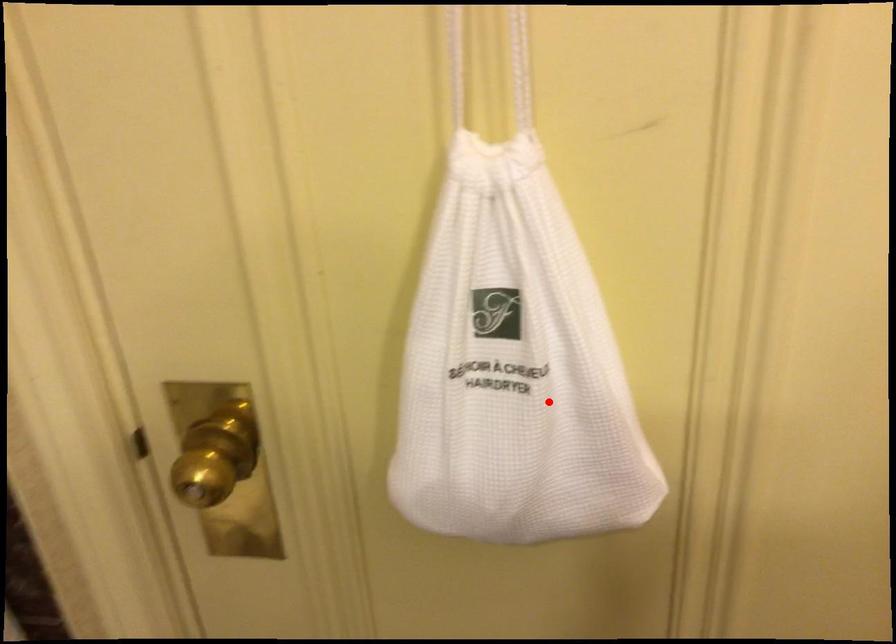
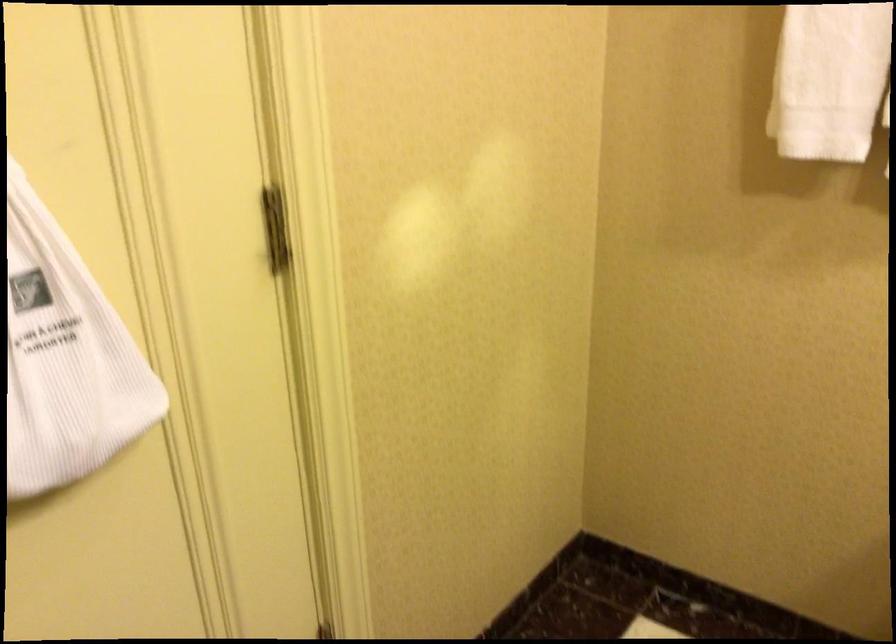
Where in the second image is the point corresponding to the highlighted location from the first image?

(65, 357)